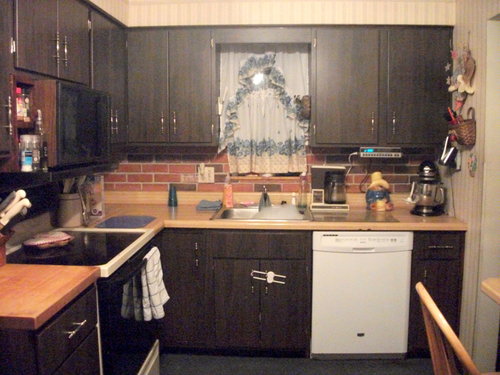
Where is `towel`? The image size is (500, 375). towel is located at coordinates (152, 285).